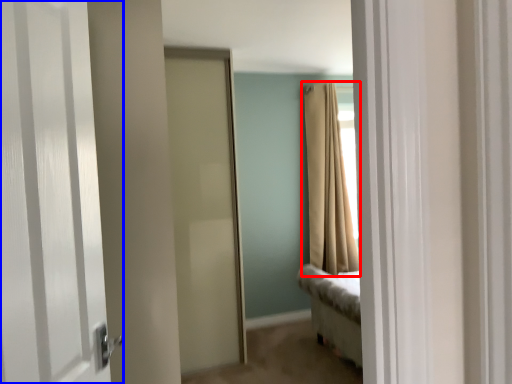
Question: Which point is further to the camera, curtain (highlighted by a red box) or door (highlighted by a blue box)?

Choices:
 (A) curtain
 (B) door

Answer: (A)